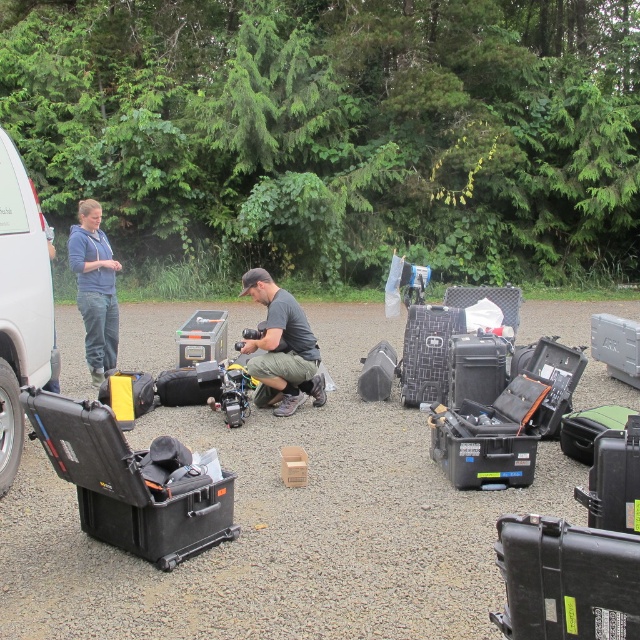
Question: Which of these objects is positioned farthest from the black hard case at center?

Choices:
 (A) white matte van at left
 (B) black hard shell suitcase at center
 (C) matte black camera at center
 (D) blue cotton hoodie at upper left

Answer: (D)

Question: Can you confirm if black hard case at center is thinner than black matte suitcase at center?

Choices:
 (A) no
 (B) yes

Answer: (A)

Question: Is matte black camera at center smaller than textured black suitcase at center?

Choices:
 (A) yes
 (B) no

Answer: (B)

Question: Which point is closer to the camera taking this photo?

Choices:
 (A) (369, 589)
 (B) (200, 364)
 (C) (440, 332)
 (D) (36, 262)

Answer: (A)

Question: Observing the image, what is the correct spatial positioning of textured black suitcase at center in reference to black hard shell suitcase at center?

Choices:
 (A) above
 (B) below

Answer: (A)

Question: Which of these objects is positioned closest to the textured black suitcase at center?

Choices:
 (A) blue cotton hoodie at upper left
 (B) black matte suitcase at center

Answer: (B)